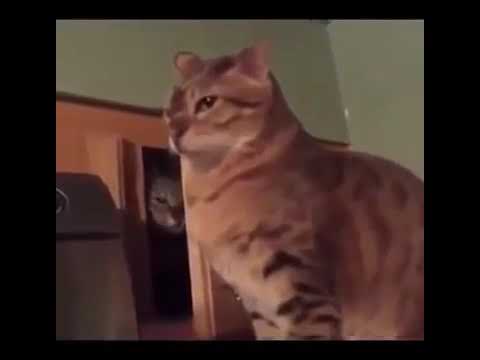
Identify the location of door. [x=162, y=260].